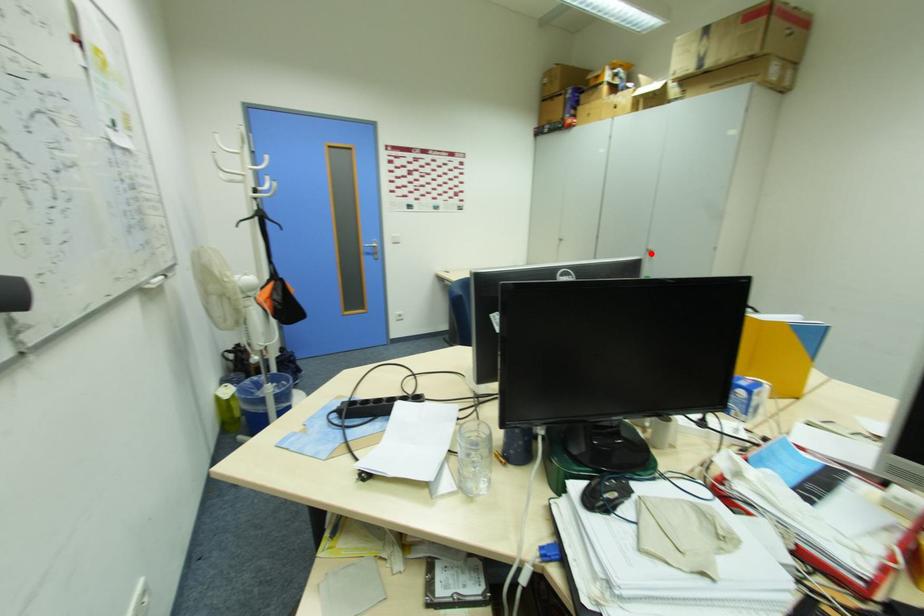
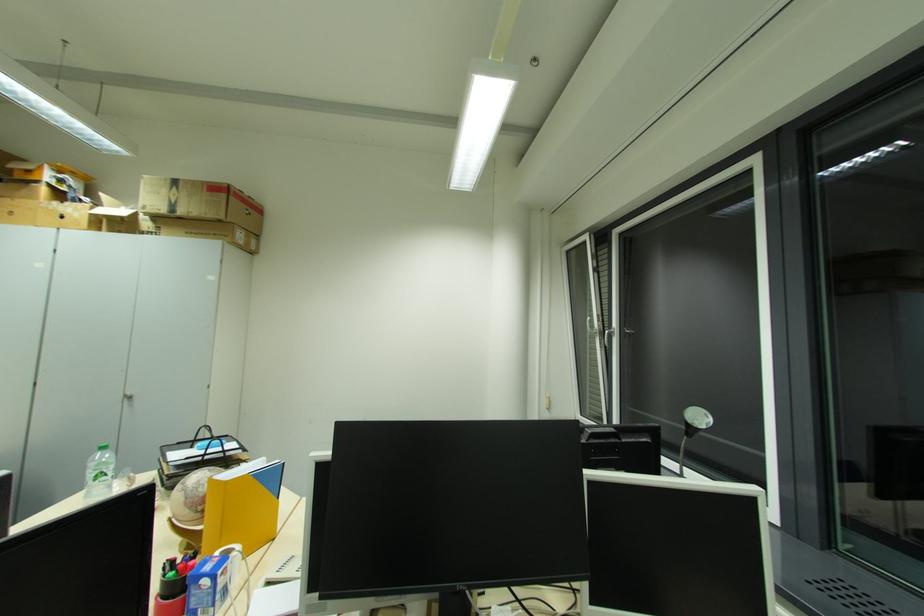
Question: I am providing you with two images of the same scene from different viewpoints. In image1, a red point is highlighted. Considering the same 3D point in image2, which of the following is correct?

Choices:
 (A) It is closer
 (B) It is farther

Answer: (A)